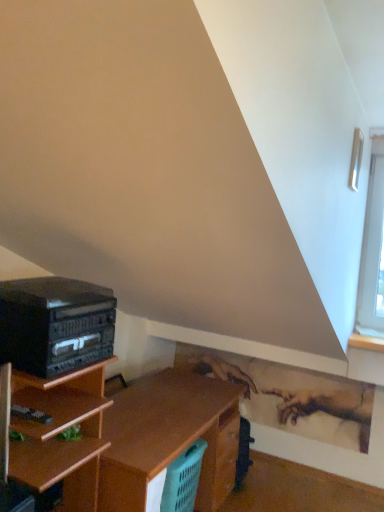
Where is `clear glass window at upper right`? clear glass window at upper right is located at coordinates (356, 159).

From the picture: Which of these two, clear glass window at upper right or teal plastic laundry basket at lower center, is thinner?

With smaller width is clear glass window at upper right.

Which point is more distant from viewer, (359, 162) or (163, 495)?

The point (163, 495) is farther from the camera.

Is teal plastic laundry basket at lower center thinner than clear glass window at upper right?

Incorrect, the width of teal plastic laundry basket at lower center is not less than that of clear glass window at upper right.

Is teal plastic laundry basket at lower center located outside clear glass window at upper right?

Absolutely, teal plastic laundry basket at lower center is external to clear glass window at upper right.

Considering the relative positions of teal plastic laundry basket at lower center and clear glass window at upper right in the image provided, is teal plastic laundry basket at lower center to the right of clear glass window at upper right from the viewer's perspective?

Incorrect, teal plastic laundry basket at lower center is not on the right side of clear glass window at upper right.

Can you see teal plastic laundry basket at lower center touching clear glass window at upper right?

No, teal plastic laundry basket at lower center is not beside clear glass window at upper right.

Is clear glass window at upper right facing towards black matte stereo at left?

No, clear glass window at upper right is not aimed at black matte stereo at left.

Consider the image. Does clear glass window at upper right come behind black matte stereo at left?

Yes, clear glass window at upper right is further from the camera.

Considering the sizes of clear glass window at upper right and black matte stereo at left in the image, is clear glass window at upper right wider or thinner than black matte stereo at left?

In the image, clear glass window at upper right appears to be more narrow than black matte stereo at left.

Considering the positions of points (357, 164) and (85, 359), is point (357, 164) farther from camera compared to point (85, 359)?

That is True.

Is black matte stereo at left taller than teal plastic laundry basket at lower center?

Incorrect, the height of black matte stereo at left is not larger of that of teal plastic laundry basket at lower center.

Is black matte stereo at left facing away from teal plastic laundry basket at lower center?

black matte stereo at left does not have its back to teal plastic laundry basket at lower center.

Considering the sizes of black matte stereo at left and teal plastic laundry basket at lower center in the image, is black matte stereo at left wider or thinner than teal plastic laundry basket at lower center?

In the image, black matte stereo at left appears to be wider than teal plastic laundry basket at lower center.

Is black matte stereo at left wider or thinner than clear glass window at upper right?

Considering their sizes, black matte stereo at left looks broader than clear glass window at upper right.

How different are the orientations of black matte stereo at left and clear glass window at upper right in degrees?

1.59 degrees.

Is clear glass window at upper right at the back of black matte stereo at left?

No, black matte stereo at left is not facing the opposite direction of clear glass window at upper right.

Is black matte stereo at left at the right side of clear glass window at upper right?

No.

Can you confirm if teal plastic laundry basket at lower center is shorter than black matte stereo at left?

No, teal plastic laundry basket at lower center is not shorter than black matte stereo at left.

Which object is further away from the camera taking this photo, teal plastic laundry basket at lower center or black matte stereo at left?

teal plastic laundry basket at lower center.

I want to click on basket located below the black matte stereo at left (from the image's perspective), so click(183, 479).

From a real-world perspective, is teal plastic laundry basket at lower center located higher than black matte stereo at left?

No, from a real-world perspective, teal plastic laundry basket at lower center is not over black matte stereo at left

The width and height of the screenshot is (384, 512). I want to click on basket below the clear glass window at upper right (from the image's perspective), so click(x=183, y=479).

Find the location of a particular element. The image size is (384, 512). basket below the clear glass window at upper right (from a real-world perspective) is located at coordinates (183, 479).

Looking at the image, which one is located further to clear glass window at upper right, teal plastic laundry basket at lower center or black matte stereo at left?

teal plastic laundry basket at lower center lies further to clear glass window at upper right than the other object.

From the image, which object appears to be nearer to black matte stereo at left, teal plastic laundry basket at lower center or clear glass window at upper right?

teal plastic laundry basket at lower center lies closer to black matte stereo at left than the other object.

When comparing their distances from clear glass window at upper right, does black matte stereo at left or teal plastic laundry basket at lower center seem closer?

The object closer to clear glass window at upper right is black matte stereo at left.

Estimate the real-world distances between objects in this image. Which object is closer to black matte stereo at left, clear glass window at upper right or teal plastic laundry basket at lower center?

Based on the image, teal plastic laundry basket at lower center appears to be nearer to black matte stereo at left.

Which object lies nearer to the anchor point teal plastic laundry basket at lower center, black matte stereo at left or clear glass window at upper right?

The object closer to teal plastic laundry basket at lower center is black matte stereo at left.

From the image, which object appears to be farther from teal plastic laundry basket at lower center, clear glass window at upper right or black matte stereo at left?

clear glass window at upper right lies further to teal plastic laundry basket at lower center than the other object.

You are a GUI agent. You are given a task and a screenshot of the screen. Output one action in this format:
    pyautogui.click(x=<x>, y=<y>)
    Task: Click on the stereo between clear glass window at upper right and teal plastic laundry basket at lower center from top to bottom
    Image resolution: width=384 pixels, height=512 pixels.
    Given the screenshot: What is the action you would take?
    pyautogui.click(x=55, y=324)